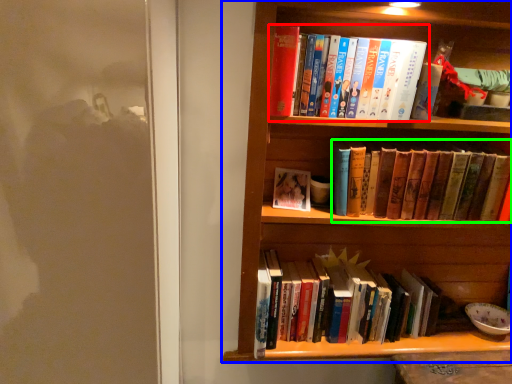
Question: Which object is positioned farthest from book (highlighted by a red box)? Select from bookcase (highlighted by a blue box) and book (highlighted by a green box).

Choices:
 (A) bookcase
 (B) book

Answer: (A)